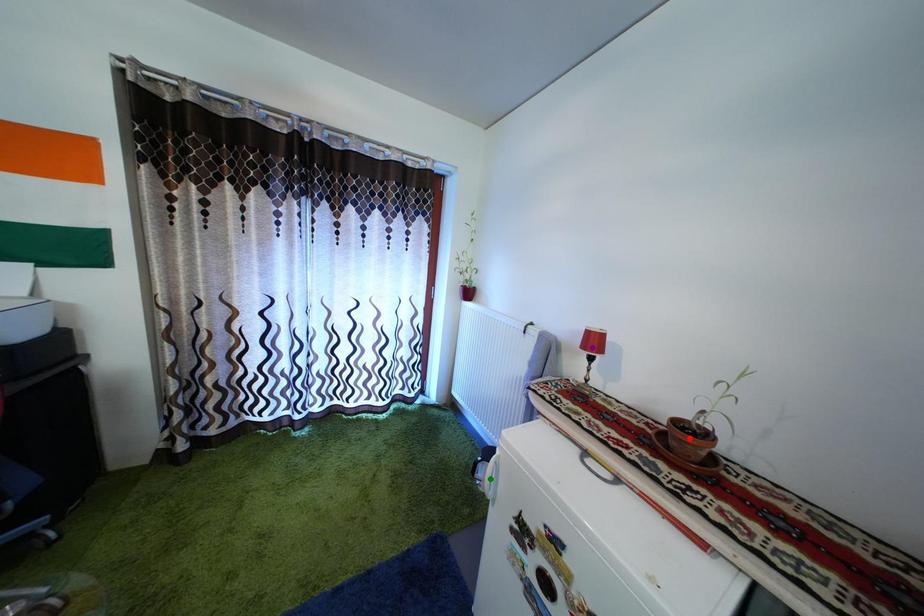
Order these from nearest to farthest:
purple point, red point, green point

red point
purple point
green point